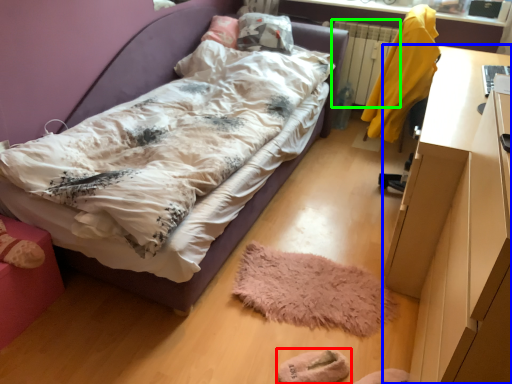
Question: Estimate the real-world distances between objects in this image. Which object is closer to footwear (highlighted by a red box), desk (highlighted by a blue box) or radiator (highlighted by a green box)?

Choices:
 (A) desk
 (B) radiator

Answer: (A)